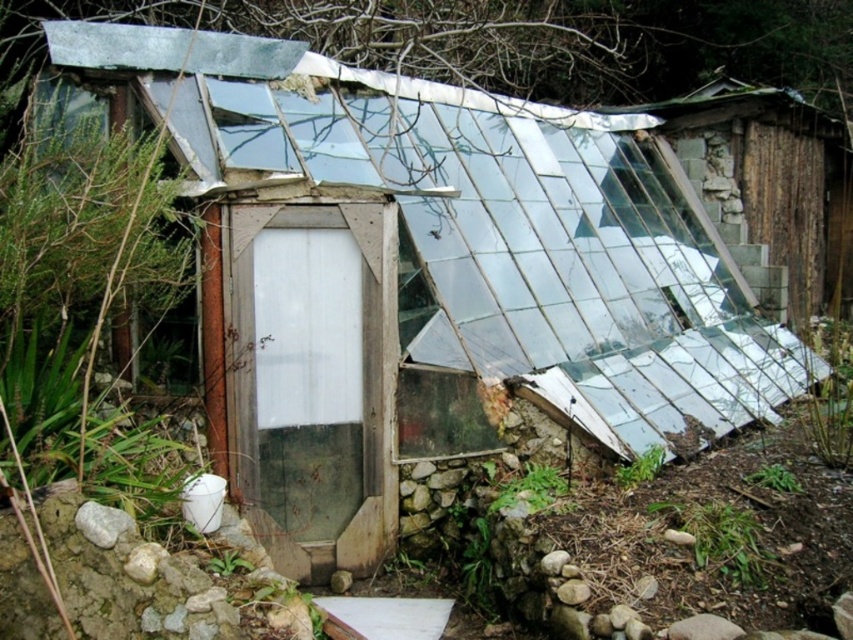
You are standing at the entrance of the greenhouse and notice the transparent glass hut at right and the gray rock at lower left. Which object is positioned higher relative to the other?

The transparent glass hut at right is located above the gray rock at lower left, so it is positioned higher.

You are standing outside the greenhouse and want to pick up the gray rock at lower left. Can you reach it without moving the transparent glass hut at right?

The gray rock at lower left is behind the transparent glass hut at right, so you cannot reach it without moving the transparent glass hut at right.

You are standing in the greenhouse and want to exit through the front door. To do so, you need to move past the gray rock at lower left and the transparent glass hut at right. Which object should you move around first to reach the door?

You should move around the gray rock at lower left first because the transparent glass hut at right is positioned on the right side of gray rock at lower left, meaning the gray rock is closer to your current position.